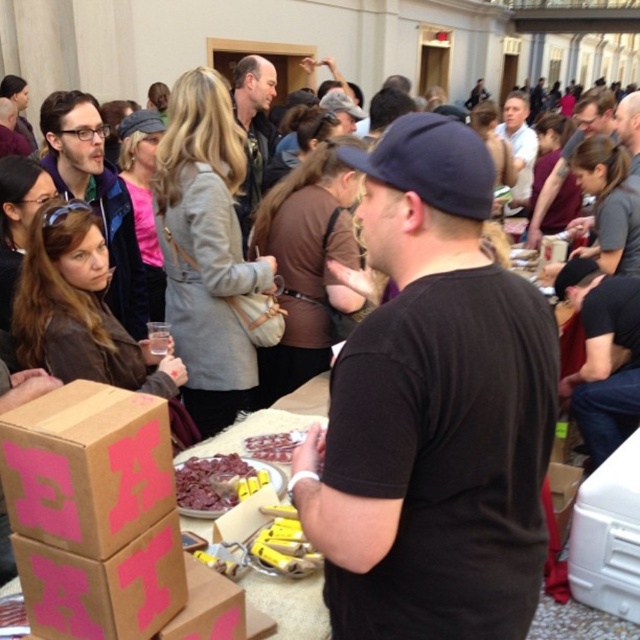
Is point (218, 467) more distant than point (260, 436)?

No, (218, 467) is closer to viewer.

Between dark brown textured meat at center and shiny chocolate bar at center, which one has less height?

shiny chocolate bar at center is shorter.

Where is `dark brown textured meat at center`? The height and width of the screenshot is (640, 640). dark brown textured meat at center is located at coordinates (209, 481).

Describe the element at coordinates (86, 467) in the screenshot. Image resolution: width=640 pixels, height=640 pixels. I see `brown cardboard box at lower left` at that location.

Is brown cardboard box at lower left below yellow plastic bananas at center?

No.

Who is more distant from viewer, (173, 490) or (280, 524)?

Point (280, 524)

Where is `brown cardboard box at lower left`? brown cardboard box at lower left is located at coordinates point(86,467).

Who is more forward, (260, 182) or (515, 186)?

Positioned in front is point (260, 182).

Is point (269, 92) positioned in front of point (499, 131)?

Yes, point (269, 92) is closer to viewer.

The image size is (640, 640). I want to click on matte gray jacket at center, so click(x=252, y=129).